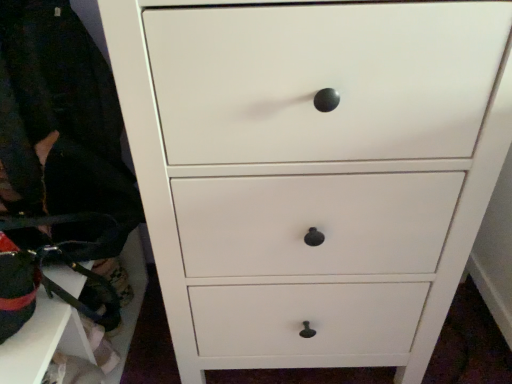
Where is `white matte cabinet at lower left`? The width and height of the screenshot is (512, 384). white matte cabinet at lower left is located at coordinates (42, 341).

What do you see at coordinates (42, 341) in the screenshot? I see `white matte cabinet at lower left` at bounding box center [42, 341].

Measure the distance between point (78,317) and camera.

Point (78,317) is 85.50 centimeters away from camera.

This screenshot has width=512, height=384. Describe the element at coordinates (62, 127) in the screenshot. I see `black fabric at left` at that location.

This screenshot has width=512, height=384. I want to click on black fabric at left, so click(x=62, y=127).

Locate an element on the screen. white matte cabinet at lower left is located at coordinates (42, 341).

In the image, is white matte cabinet at lower left on the left side or the right side of black fabric at left?

white matte cabinet at lower left is to the left of black fabric at left.

Considering the relative positions of white matte cabinet at lower left and black fabric at left in the image provided, is white matte cabinet at lower left behind black fabric at left?

That is True.

Which point is more forward, (32, 358) or (11, 118)?

The point (32, 358) is more forward.

From the image's perspective, would you say white matte cabinet at lower left is positioned over black fabric at left?

No, from the image's perspective, white matte cabinet at lower left is not above black fabric at left.

From a real-world perspective, is white matte cabinet at lower left under black fabric at left?

Yes, from a real-world perspective, white matte cabinet at lower left is under black fabric at left.

Between white matte cabinet at lower left and black fabric at left, which one has smaller width?

white matte cabinet at lower left.

Which of these two, white matte cabinet at lower left or black fabric at left, stands shorter?

Standing shorter between the two is white matte cabinet at lower left.

Considering the sizes of objects white matte cabinet at lower left and black fabric at left in the image provided, who is smaller, white matte cabinet at lower left or black fabric at left?

Smaller between the two is black fabric at left.

Is black fabric at left a part of white matte cabinet at lower left?

That's incorrect, black fabric at left is not inside white matte cabinet at lower left.

In the scene shown: Are white matte cabinet at lower left and black fabric at left making contact?

No, white matte cabinet at lower left is not making contact with black fabric at left.

Is white matte cabinet at lower left positioned with its back to black fabric at left?

No, black fabric at left is not at the back of white matte cabinet at lower left.

What's the angular difference between white matte cabinet at lower left and black fabric at left's facing directions?

The angle between the facing direction of white matte cabinet at lower left and the facing direction of black fabric at left is 1.17 degrees.

I want to click on clothing above the white matte cabinet at lower left (from a real-world perspective), so click(62, 127).

Considering the positions of objects black fabric at left and white matte cabinet at lower left in the image provided, who is more to the left, black fabric at left or white matte cabinet at lower left?

Positioned to the left is white matte cabinet at lower left.

Does black fabric at left come behind white matte cabinet at lower left?

No, black fabric at left is closer to the viewer.

Does point (12, 132) come in front of point (34, 365)?

No, it is behind (34, 365).

From the image's perspective, does black fabric at left appear higher than white matte cabinet at lower left?

Yes.

From a real-world perspective, is black fabric at left above or below white matte cabinet at lower left?

In terms of real-world spatial position, black fabric at left is above white matte cabinet at lower left.

Considering the sizes of objects black fabric at left and white matte cabinet at lower left in the image provided, who is thinner, black fabric at left or white matte cabinet at lower left?

Thinner between the two is white matte cabinet at lower left.

Considering the sizes of objects black fabric at left and white matte cabinet at lower left in the image provided, who is taller, black fabric at left or white matte cabinet at lower left?

black fabric at left.

Who is bigger, black fabric at left or white matte cabinet at lower left?

white matte cabinet at lower left.

Consider the image. Is black fabric at left outside of white matte cabinet at lower left?

Yes.

Are black fabric at left and white matte cabinet at lower left located far from each other?

black fabric at left is actually quite close to white matte cabinet at lower left.

Is black fabric at left positioned with its back to white matte cabinet at lower left?

No, black fabric at left is not facing the opposite direction of white matte cabinet at lower left.

What's the angular difference between black fabric at left and white matte cabinet at lower left's facing directions?

1.17 degrees separate the facing orientations of black fabric at left and white matte cabinet at lower left.

You are a GUI agent. You are given a task and a screenshot of the screen. Output one action in this format:
    pyautogui.click(x=<x>, y=<y>)
    Task: Click on the cabinetry on the left of black fabric at left
    Image resolution: width=512 pixels, height=384 pixels.
    Given the screenshot: What is the action you would take?
    pyautogui.click(x=42, y=341)

Locate an element on the screen. This screenshot has height=384, width=512. clothing in front of the white matte cabinet at lower left is located at coordinates (62, 127).

Locate an element on the screen. This screenshot has width=512, height=384. clothing that appears on the right of white matte cabinet at lower left is located at coordinates (62, 127).